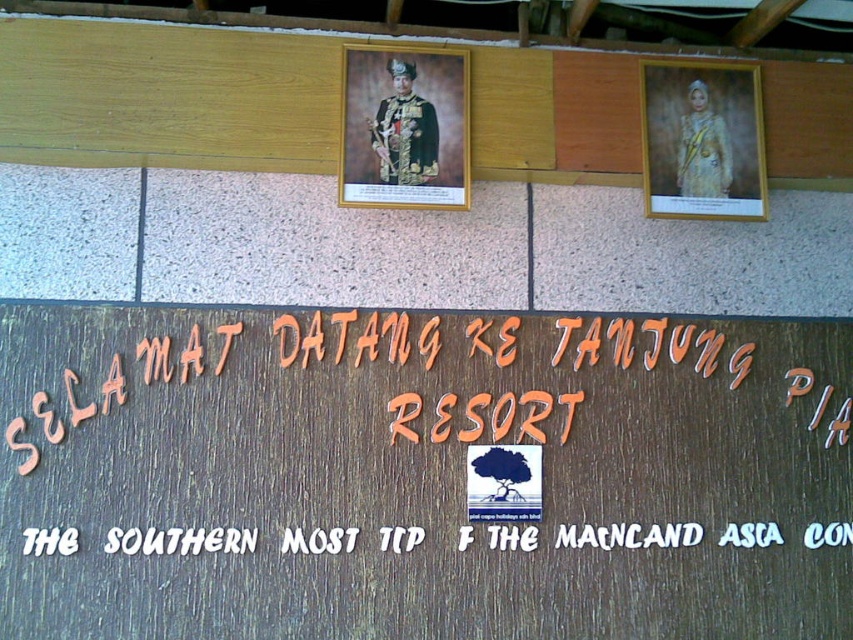
You are standing in front of the wooden signboard and notice two items at the upper center area. Which one is positioned higher between the wooden frame at upper center and the gold textured uniform at upper center?

The wooden frame at upper center is positioned higher than the gold textured uniform at upper center as it is located above it.

You are standing in front of the wooden signboard and notice two points marked on the image. Which point, point (102,38) or point (408,77), is closer to you?

Point (102,38) is closer to you because it is in front of point (408,77).